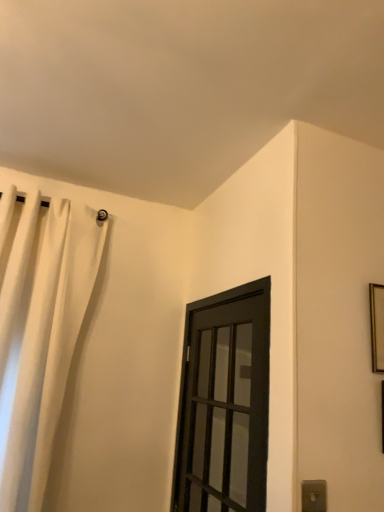
Question: From a real-world perspective, is black matte door at center physically located above or below white fabric curtain at upper left?

Choices:
 (A) below
 (B) above

Answer: (A)

Question: From the image's perspective, relative to white fabric curtain at upper left, is black matte door at center above or below?

Choices:
 (A) above
 (B) below

Answer: (B)

Question: Which of these objects is positioned closest to the white fabric curtain at upper left?

Choices:
 (A) black matte door at center
 (B) gold metallic picture frame at upper right
 (C) gray plastic electric outlet at lower right

Answer: (A)

Question: Which of these objects is positioned closest to the gray plastic electric outlet at lower right?

Choices:
 (A) gold metallic picture frame at upper right
 (B) black matte door at center
 (C) white fabric curtain at upper left

Answer: (A)